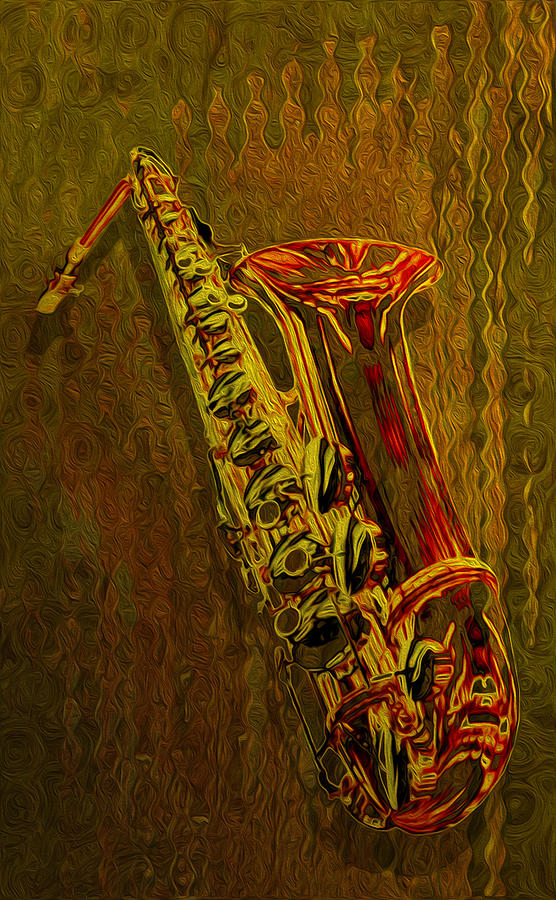
Where is `corners`? corners is located at coordinates 541,888, 14,885, 13,13, 541,11.